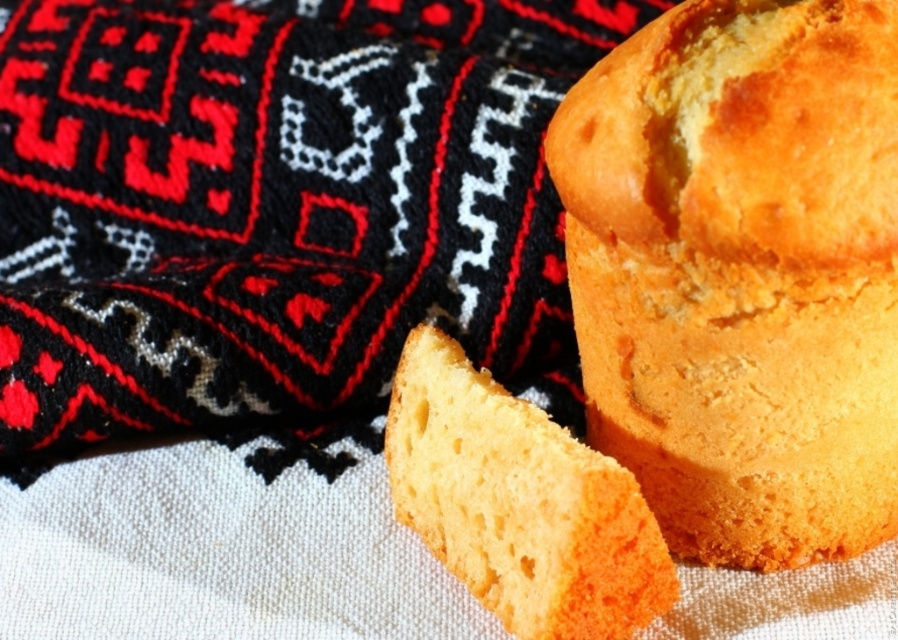
You are a baker who wants to place both the golden sponge muffin at center and the yellow sponge cake at center on a 15 cm wide plate. Can both fit side by side without overlapping?

The golden sponge muffin at center is wider than the yellow sponge cake at center. However, since the combined width of both items would exceed the 15 cm plate, they cannot fit side by side without overlapping.

You are a baker holding a 12 inch long spatula. You want to place it on the golden sponge muffin at center. Is the spatula long enough to reach from one edge of the muffin to the other?

The golden sponge muffin at center and camera are 32.05 inches apart. The spatula is only 12 inches long, so it is not long enough to reach from one edge of the muffin to the other.

You are a baker who wants to place both the golden sponge muffin at center and the yellow sponge cake at center onto a round plate. The plate has a diameter of 15 cm. Can both items fit on the plate without overlapping?

The golden sponge muffin at center is larger in size than the yellow sponge cake at center. However, without knowing the exact dimensions of both items, it is impossible to determine if they can fit on a 15 cm diameter plate without overlapping.